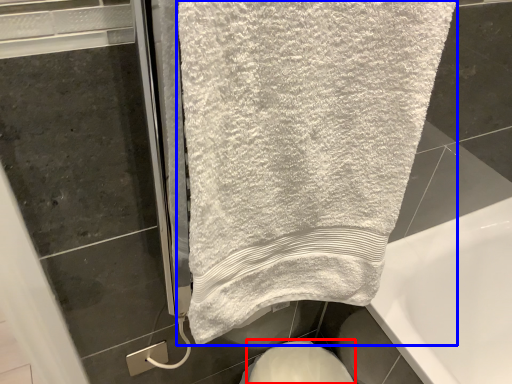
Question: Which point is closer to the camera, bidet (highlighted by a red box) or towel (highlighted by a blue box)?

Choices:
 (A) bidet
 (B) towel

Answer: (B)